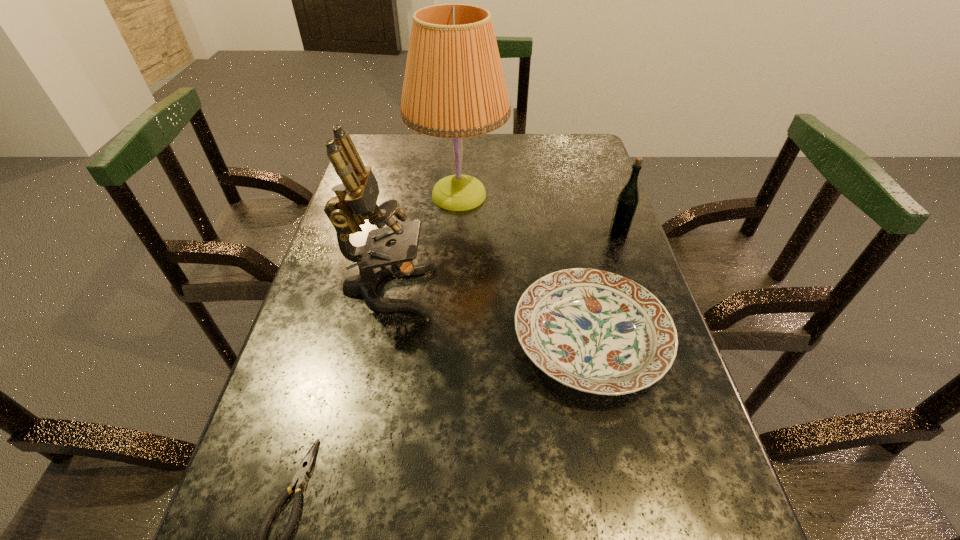
Where is `object that is at the far edge`? Image resolution: width=960 pixels, height=540 pixels. object that is at the far edge is located at coordinates (454, 87).

This screenshot has height=540, width=960. I want to click on object situated at the left edge, so click(356, 197).

This screenshot has height=540, width=960. I want to click on beer bottle present at the right edge, so click(626, 204).

Find the location of `plate situated at the right edge`. plate situated at the right edge is located at coordinates (598, 332).

The image size is (960, 540). In the image, there is a desktop. Find the location of `free region at the far edge`. free region at the far edge is located at coordinates (445, 155).

Identify the location of free space at the left edge of the desktop. (354, 392).

I want to click on free space at the right edge of the desktop, so click(631, 462).

Identify the location of vacant space at the far left corner. Image resolution: width=960 pixels, height=540 pixels. (382, 137).

In the image, there is a desktop. Where is `free region at the far right corner`? This screenshot has height=540, width=960. free region at the far right corner is located at coordinates (569, 166).

What are the coordinates of `free space that is in between the fourth shortest object and the farthest object` in the screenshot? It's located at (423, 242).